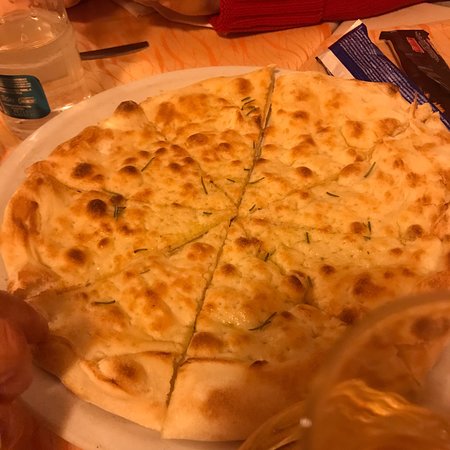
You are a GUI agent. You are given a task and a screenshot of the screen. Output one action in this format:
    pyautogui.click(x=<x>, y=<y>)
    Task: Click on the glass handle of the cup to the lower right
    This screenshot has width=450, height=450.
    Given the screenshot: What is the action you would take?
    pyautogui.click(x=277, y=440)